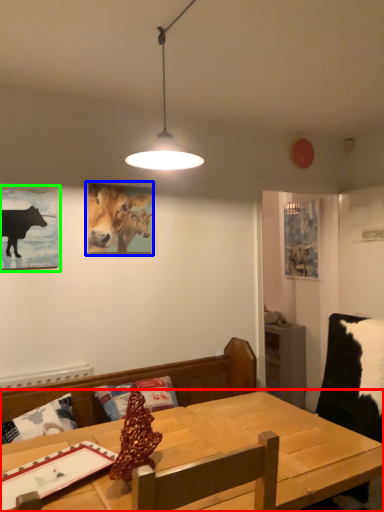
Question: Based on their relative distances, which object is farther from table (highlighted by a red box)? Choose from picture frame (highlighted by a blue box) and picture frame (highlighted by a green box).

Choices:
 (A) picture frame
 (B) picture frame

Answer: (A)